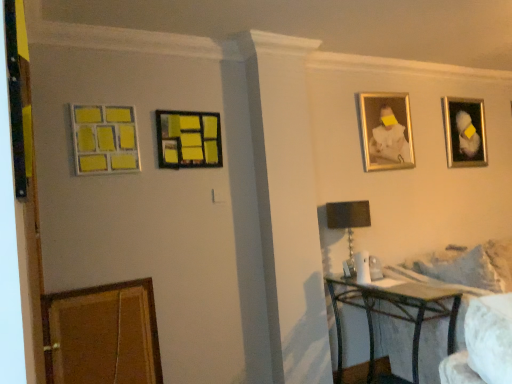
Question: Can you confirm if metallic silver picture frame at upper right, the 1th picture frame positioned from the right, is positioned to the left of yellow matte picture frame at upper left, which is the 1th picture frame from left to right?

Choices:
 (A) no
 (B) yes

Answer: (A)

Question: Can you confirm if metallic silver picture frame at upper right, which is the 1th picture frame in back-to-front order, is positioned to the right of yellow matte picture frame at upper left, the fourth picture frame viewed from the back?

Choices:
 (A) yes
 (B) no

Answer: (A)

Question: From a real-world perspective, is metallic silver picture frame at upper right, which is the 1th picture frame in back-to-front order, on top of yellow matte picture frame at upper left, which is the 1th picture frame from left to right?

Choices:
 (A) yes
 (B) no

Answer: (A)

Question: Is yellow matte picture frame at upper left, the fourth picture frame viewed from the back, located within metallic silver picture frame at upper right, which is the fourth picture frame in front-to-back order?

Choices:
 (A) no
 (B) yes

Answer: (A)

Question: Does metallic silver picture frame at upper right, the 1th picture frame positioned from the right, have a lesser height compared to yellow matte picture frame at upper left, the fourth picture frame viewed from the back?

Choices:
 (A) yes
 (B) no

Answer: (B)

Question: Would you say gold metallic picture frame at upper right, the third picture frame positioned from the front, is to the left or to the right of yellow matte picture frame at upper left, which is the 1th picture frame from left to right, in the picture?

Choices:
 (A) right
 (B) left

Answer: (A)

Question: Does point (384, 104) appear closer or farther from the camera than point (119, 107)?

Choices:
 (A) farther
 (B) closer

Answer: (A)

Question: In terms of height, does gold metallic picture frame at upper right, the third picture frame in the left-to-right sequence, look taller or shorter compared to yellow matte picture frame at upper left, marked as the first picture frame in a front-to-back arrangement?

Choices:
 (A) tall
 (B) short

Answer: (A)

Question: From a real-world perspective, is gold metallic picture frame at upper right, the 2th picture frame when ordered from back to front, positioned above or below yellow matte picture frame at upper left, which is the 1th picture frame from left to right?

Choices:
 (A) above
 (B) below

Answer: (A)

Question: Considering the positions of yellow matte picture frame at upper left, which is the 1th picture frame from left to right, and white fluffy pillow at right in the image, is yellow matte picture frame at upper left, which is the 1th picture frame from left to right, wider or thinner than white fluffy pillow at right?

Choices:
 (A) wide
 (B) thin

Answer: (B)

Question: Is yellow matte picture frame at upper left, marked as the first picture frame in a front-to-back arrangement, spatially inside white fluffy pillow at right, or outside of it?

Choices:
 (A) outside
 (B) inside

Answer: (A)

Question: Visually, is yellow matte picture frame at upper left, marked as the first picture frame in a front-to-back arrangement, positioned to the left or to the right of white fluffy pillow at right?

Choices:
 (A) right
 (B) left

Answer: (B)

Question: From a real-world perspective, relative to white fluffy pillow at right, is yellow matte picture frame at upper left, which is the 4th picture frame from right to left, vertically above or below?

Choices:
 (A) above
 (B) below

Answer: (A)

Question: Considering the positions of point (443, 286) and point (474, 139), is point (443, 286) closer or farther from the camera than point (474, 139)?

Choices:
 (A) farther
 (B) closer

Answer: (B)

Question: Is metallic black table at lower right taller or shorter than metallic silver picture frame at upper right, which ranks as the 4th picture frame in left-to-right order?

Choices:
 (A) tall
 (B) short

Answer: (A)